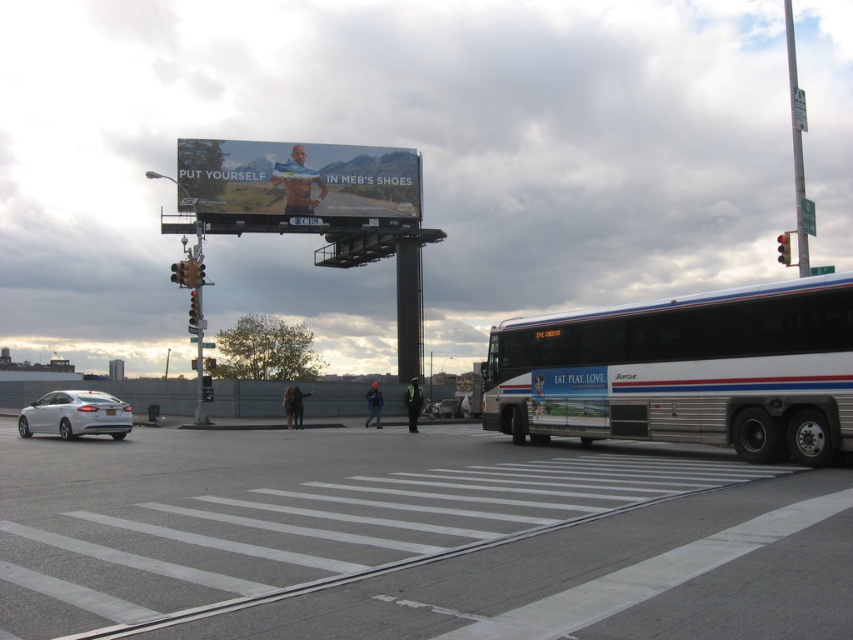
Does matte plastic billboard at upper center have a greater width compared to red glass traffic light at upper right?

No, matte plastic billboard at upper center is not wider than red glass traffic light at upper right.

Which is in front, point (288, 193) or point (780, 250)?

Point (780, 250)

Identify the location of matte plastic billboard at upper center. This screenshot has width=853, height=640. (297, 179).

Who is positioned more to the left, metallic traffic light at left or metallic silver sedan at center?

From the viewer's perspective, metallic traffic light at left appears more on the left side.

In the scene shown: How much distance is there between metallic traffic light at left and metallic silver sedan at center?

They are 41.65 feet apart.

Is point (190, 317) farther from viewer compared to point (440, 410)?

No, it is not.

Where is `metallic traffic light at left`? The height and width of the screenshot is (640, 853). metallic traffic light at left is located at coordinates (193, 312).

Does white metallic bus at center-right have a greater height compared to white glossy sedan at lower left?

Indeed, white metallic bus at center-right has a greater height compared to white glossy sedan at lower left.

Find the location of `white metallic bus at center-right`. white metallic bus at center-right is located at coordinates (685, 371).

Is point (653, 342) farther from viewer compared to point (42, 410)?

No, it is in front of (42, 410).

Locate an element on the screen. This screenshot has height=640, width=853. white metallic bus at center-right is located at coordinates (685, 371).